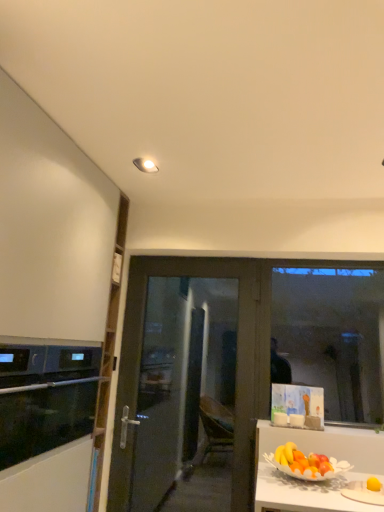
Question: Considering the relative positions of transparent glass door at center and white matte cabinet at left in the image provided, is transparent glass door at center to the left or to the right of white matte cabinet at left?

Choices:
 (A) left
 (B) right

Answer: (B)

Question: Is transparent glass door at center wider or thinner than white matte cabinet at left?

Choices:
 (A) wide
 (B) thin

Answer: (B)

Question: Based on their relative distances, which object is farther from the black glass oven at left?

Choices:
 (A) transparent glass window at right
 (B) white matte cabinet at left
 (C) transparent glass door at center

Answer: (A)

Question: Estimate the real-world distances between objects in this image. Which object is farther from the black glass oven at left?

Choices:
 (A) transparent glass window at right
 (B) transparent glass door at center
 (C) white matte cabinet at left

Answer: (A)